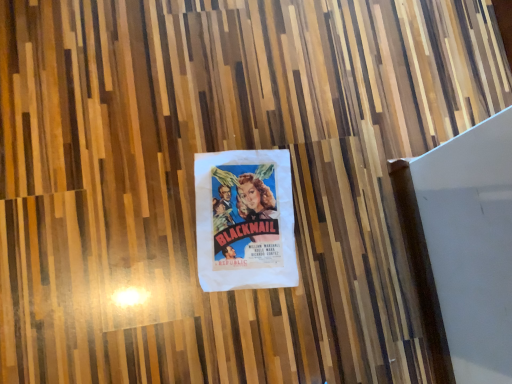
In order to face white paper poster at center, should I rotate leftwards or rightwards?

To align with it, rotate left about 1.220°.

Image resolution: width=512 pixels, height=384 pixels. What do you see at coordinates (245, 220) in the screenshot?
I see `white paper poster at center` at bounding box center [245, 220].

The width and height of the screenshot is (512, 384). Find the location of `white paper poster at center`. white paper poster at center is located at coordinates (245, 220).

This screenshot has width=512, height=384. What are the coordinates of `white paper poster at center` in the screenshot? It's located at (245, 220).